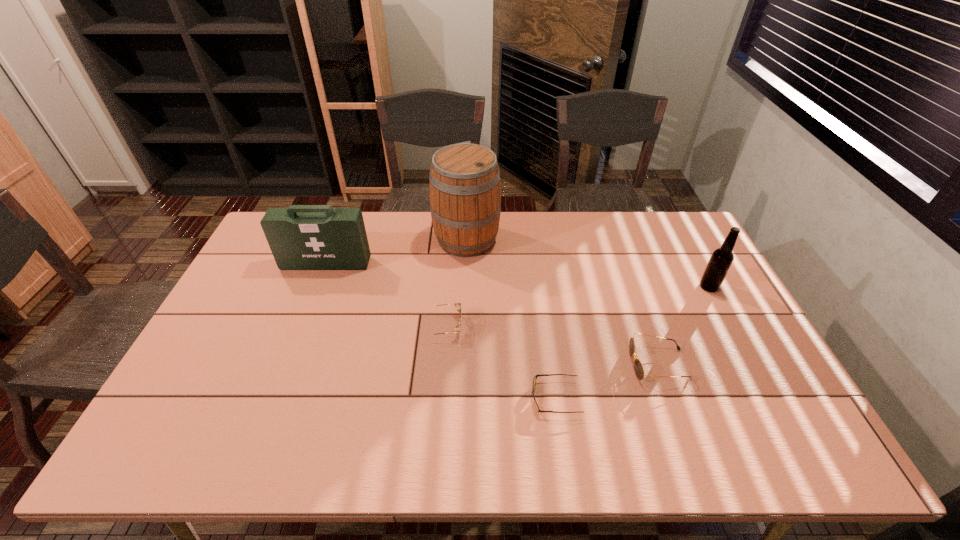
You are a GUI agent. You are given a task and a screenshot of the screen. Output one action in this format:
    pyautogui.click(x=<x>, y=<y>)
    Task: Click on the vacant point located between the rightmost sunglasses and the farthest sunglasses
    
    Given the screenshot: What is the action you would take?
    pyautogui.click(x=551, y=345)

At what (x,y) coordinates should I click in order to perform the action: click on free space between the tallest object and the rightmost object. Please return your answer as a coordinate pair (x, y). Image resolution: width=960 pixels, height=540 pixels. Looking at the image, I should click on (588, 263).

I want to click on blank region between the leftmost sunglasses and the rightmost sunglasses, so click(x=551, y=345).

The width and height of the screenshot is (960, 540). What are the coordinates of `free space between the leftmost object and the shortest object` in the screenshot? It's located at (441, 330).

Locate an element on the screen. The image size is (960, 540). free spot between the beer bottle and the tallest object is located at coordinates (588, 263).

Find the location of `free space between the leftmost object and the farthest sunglasses`. free space between the leftmost object and the farthest sunglasses is located at coordinates (x=385, y=295).

I want to click on unoccupied position between the first-aid kit and the second object from right to left, so click(x=492, y=314).

Where is `vacant area that lies between the first-aid kit and the beer bottle`? This screenshot has height=540, width=960. vacant area that lies between the first-aid kit and the beer bottle is located at coordinates (517, 275).

Locate which object ranks second in proximity to the leftmost sunglasses. Please provide its 2D coordinates. Your answer should be formatted as a tuple, i.e. [(x, y)], where the tuple contains the x and y coordinates of a point satisfying the conditions above.

[(464, 184)]

Where is `the closest object to the beer bottle`? This screenshot has width=960, height=540. the closest object to the beer bottle is located at coordinates (638, 367).